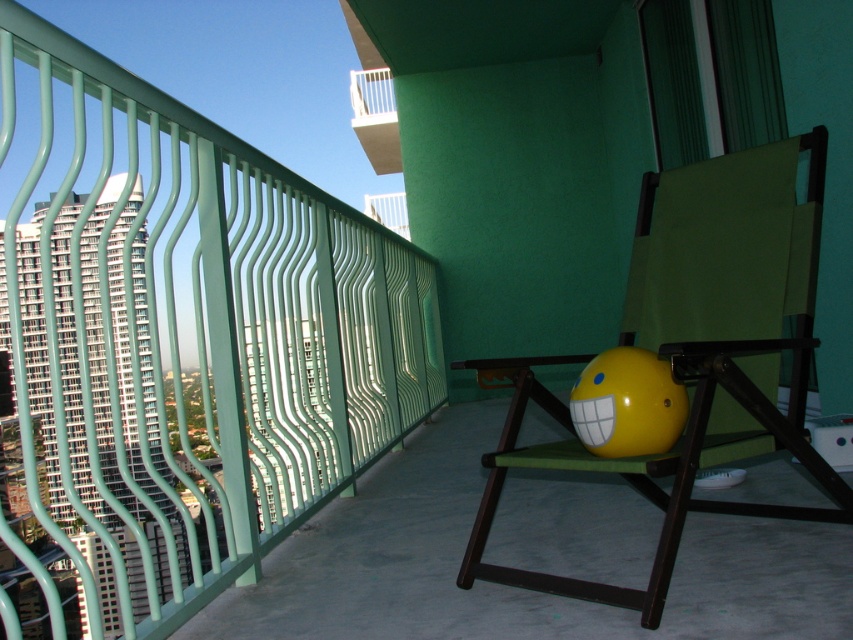
You are standing on the balcony and want to throw the bright yellow ball with a cartoonish face drawn on it from the wooden folding chair with a green cushion to a friend standing at point (381, 131). However, there is an obstacle at point (682, 461). Will the ball pass in front of or behind the obstacle?

The ball will pass in front of the obstacle at point (682, 461) because the point (682, 461) is in front of point (381, 131).

You are a delivery person who needs to place a small package on the balcony. The package is 10 cm tall. You want to ensure it doesn not fall off the balcony. Which object between the matte green folding chair at center and the yellow matte beach ball at center would be a safer place to put it?

The matte green folding chair at center is much taller than the yellow matte beach ball at center, so placing the package on the taller matte green folding chair at center would provide a safer and more stable surface to prevent it from falling off the balcony.

You are standing on the balcony and want to place a small plant pot between the yellow matte beach ball at center and the white glossy balcony at upper center. Considering their positions, which object should the plant pot be closer to?

The yellow matte beach ball at center has a lesser height compared to the white glossy balcony at upper center, so the plant pot should be placed closer to the yellow matte beach ball at center to maintain balance in height.